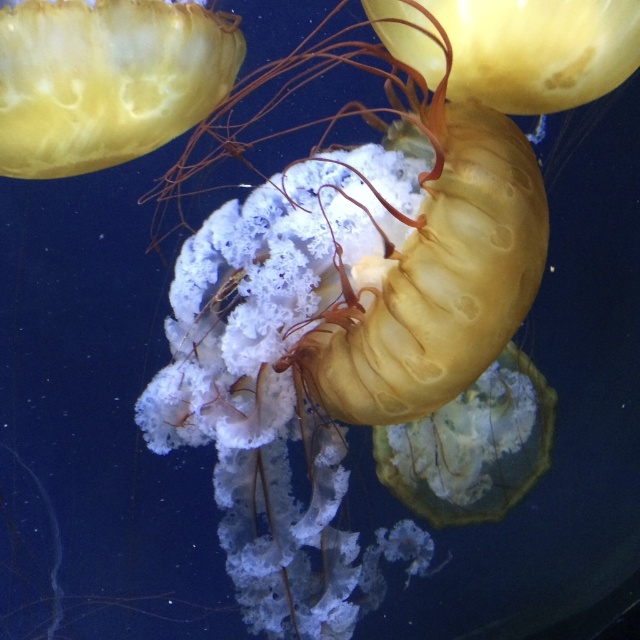
Which is more to the right, translucent yellow jellyfish at upper left or translucent yellow jellyfish at upper center?

Positioned to the right is translucent yellow jellyfish at upper center.

Which of these two, translucent yellow jellyfish at upper left or translucent yellow jellyfish at upper center, stands shorter?

translucent yellow jellyfish at upper center

Locate an element on the screen. Image resolution: width=640 pixels, height=640 pixels. translucent yellow jellyfish at upper left is located at coordinates [x=106, y=81].